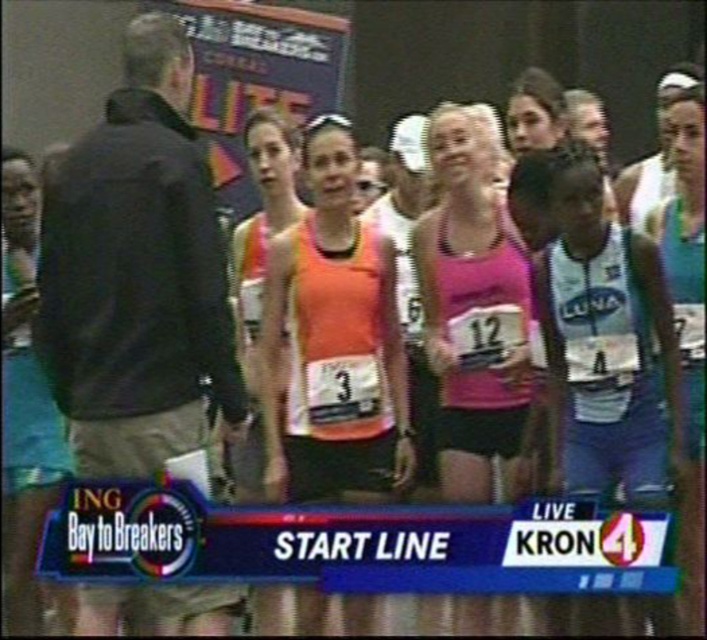
You are a race organizer looking at the starting line. You need to ensure that all runners are wearing their race numbers correctly. According to the rules, the race number must be visible on the front of the torso. Based on the image, is the pink fabric tank top at center covering the race number of the teal fabric shorts at center?

The pink fabric tank top at center is above the teal fabric shorts at center, so the race number on the teal fabric shorts at center should be visible since the tank top is positioned higher up and not covering it.

You are a photographer positioned at the starting line of the ING Bay to Breakers race. You want to take a photo of the two points marked in the scene. Which point, point (501,412) or point (35,273), will appear larger in your photo?

Point (501,412) will appear larger in the photo because it is closer to the viewer than point (35,273).